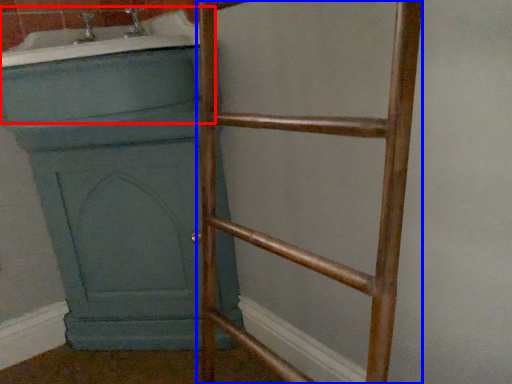
Question: Which object is further to the camera taking this photo, bath (highlighted by a red box) or ladder (highlighted by a blue box)?

Choices:
 (A) bath
 (B) ladder

Answer: (A)